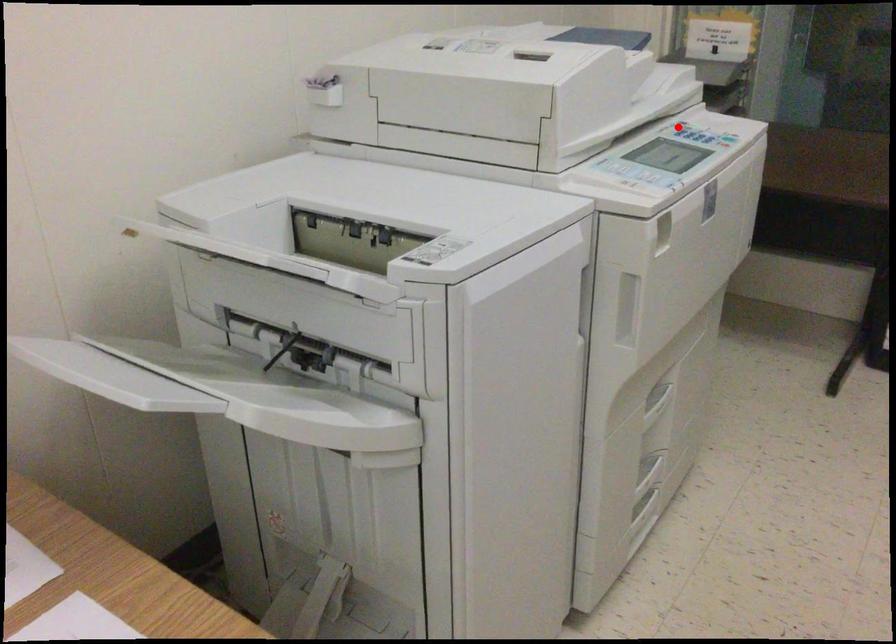
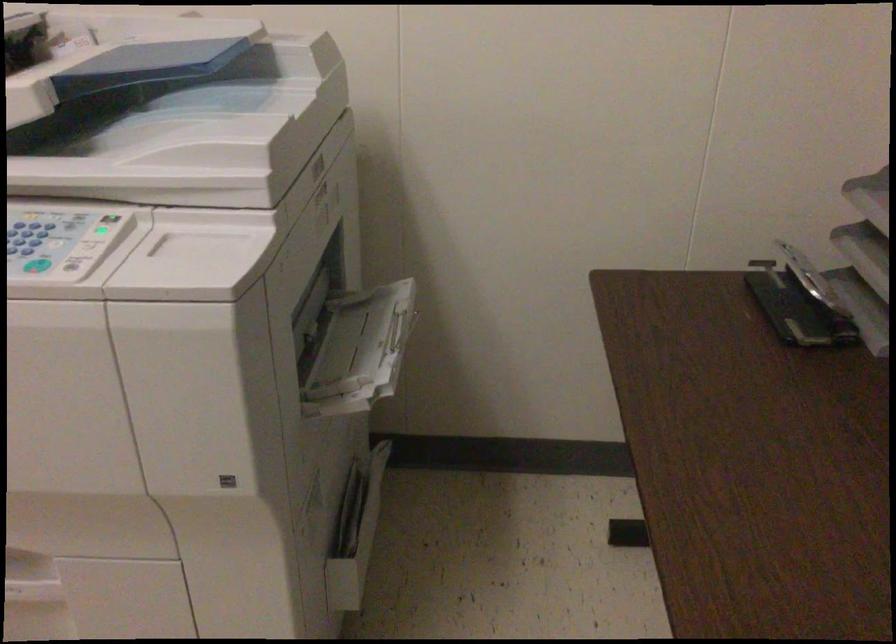
Question: I am providing you with two images of the same scene from different viewpoints. Image1 has a red point marked. In image2, the corresponding 3D location appears at what relative position? Reply with the corresponding letter.

Choices:
 (A) Closer
 (B) Farther

Answer: (A)